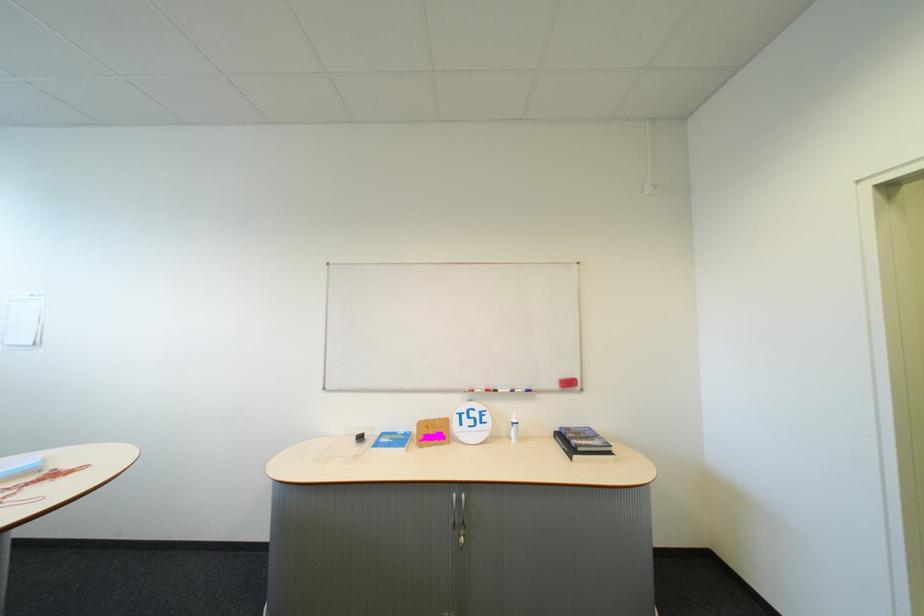
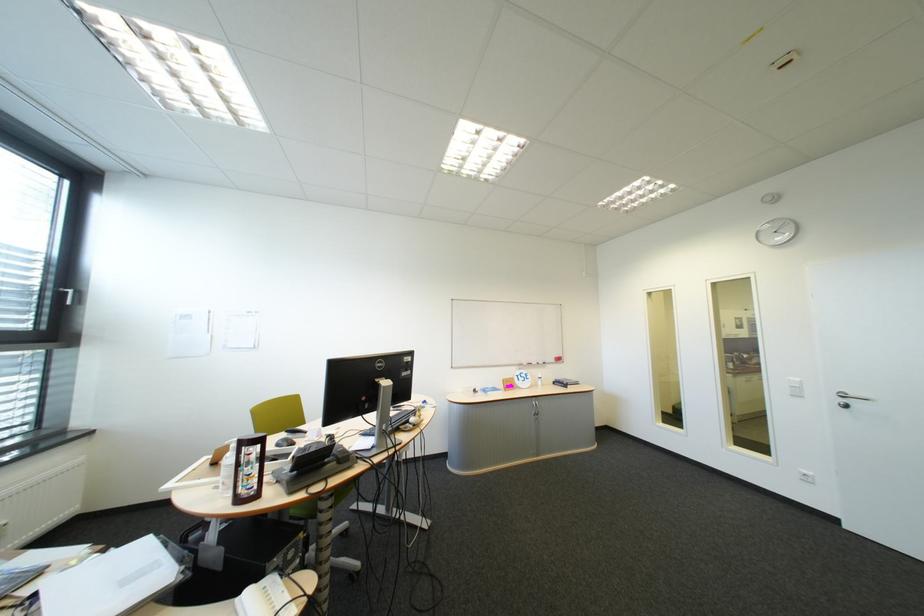
In a continuous first-person perspective shot, in which direction is the camera moving?

The cameraman walked toward left, backward.